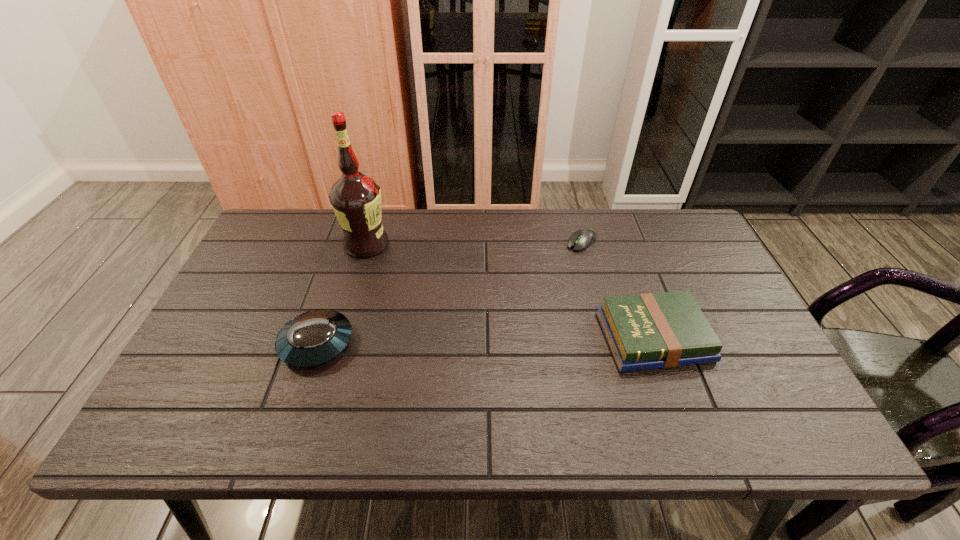
Identify the location of saucer. (313, 338).

Image resolution: width=960 pixels, height=540 pixels. I want to click on book, so click(646, 331).

This screenshot has width=960, height=540. Find the location of `computer mouse`. computer mouse is located at coordinates (583, 238).

Where is `alcohol`? The height and width of the screenshot is (540, 960). alcohol is located at coordinates (356, 198).

At what (x,y) coordinates should I click in order to perform the action: click on free space located 0.080m on the back of the saucer. Please return your answer as a coordinate pair (x, y). The height and width of the screenshot is (540, 960). Looking at the image, I should click on (x=333, y=294).

You are a GUI agent. You are given a task and a screenshot of the screen. Output one action in this format:
    pyautogui.click(x=<x>, y=<y>)
    Task: Click on the free location located 0.050m on the left of the book
    Image resolution: width=960 pixels, height=540 pixels.
    Given the screenshot: What is the action you would take?
    pyautogui.click(x=581, y=338)

At what (x,y) coordinates should I click in order to perform the action: click on free space located on the wheel side of the computer mouse. Please return your answer as a coordinate pair (x, y). The width and height of the screenshot is (960, 540). Looking at the image, I should click on pos(513,300).

The height and width of the screenshot is (540, 960). I want to click on free space located on the wheel side of the computer mouse, so click(493, 317).

Identify the location of free region located 0.260m on the wheel side of the computer mouse. (519, 294).

This screenshot has width=960, height=540. I want to click on free region located 0.380m on the label of the alcohol, so click(x=467, y=324).